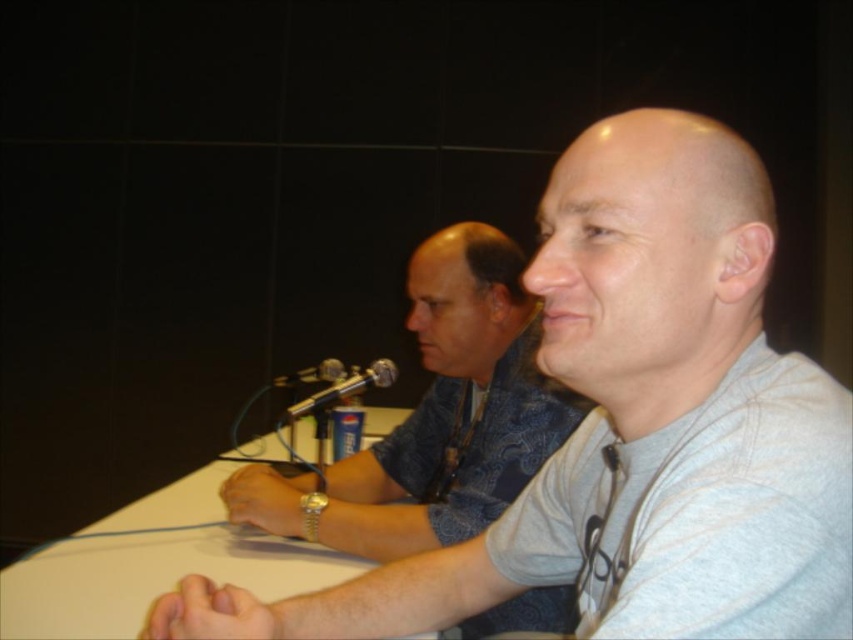
Who is positioned more to the left, white plastic table at center or metallic silver microphone at center?

white plastic table at center is more to the left.

Is white plastic table at center to the right of metallic silver microphone at center from the viewer's perspective?

→ No, white plastic table at center is not to the right of metallic silver microphone at center.

Is point (149, 512) farther from viewer compared to point (310, 403)?

That is True.

This screenshot has width=853, height=640. Find the location of `white plastic table at center`. white plastic table at center is located at coordinates (155, 564).

Does white plastic table at center have a smaller size compared to black metallic microphone at center?

Actually, white plastic table at center might be larger than black metallic microphone at center.

Is white plastic table at center shorter than black metallic microphone at center?

Correct, white plastic table at center is not as tall as black metallic microphone at center.

Image resolution: width=853 pixels, height=640 pixels. I want to click on white plastic table at center, so click(x=155, y=564).

Locate an element on the screen. This screenshot has width=853, height=640. white plastic table at center is located at coordinates (155, 564).

Between gray fabric shirt at center and white plastic table at center, which one has less height?

With less height is white plastic table at center.

Between point (364, 497) and point (300, 440), which one is positioned behind?

Point (300, 440)

At what (x,y) coordinates should I click in order to perform the action: click on gray fabric shirt at center. Please return your answer as a coordinate pair (x, y). Looking at the image, I should click on (434, 417).